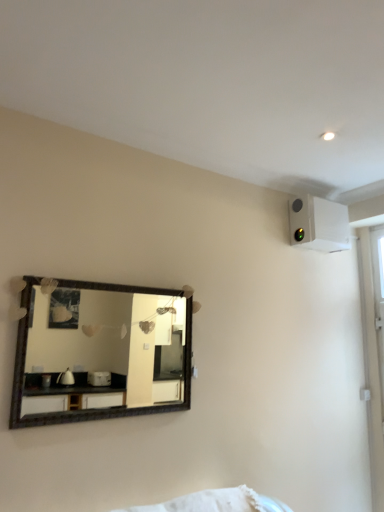
Question: Is wooden-framed mirror at upper left spatially inside white plastic air conditioning unit at upper right, or outside of it?

Choices:
 (A) inside
 (B) outside

Answer: (B)

Question: In the image, is wooden-framed mirror at upper left positioned in front of or behind white plastic air conditioning unit at upper right?

Choices:
 (A) behind
 (B) front

Answer: (B)

Question: In terms of width, does wooden-framed mirror at upper left look wider or thinner when compared to white plastic air conditioning unit at upper right?

Choices:
 (A) wide
 (B) thin

Answer: (B)

Question: Would you say white plastic air conditioning unit at upper right is to the left or to the right of wooden-framed mirror at upper left in the picture?

Choices:
 (A) right
 (B) left

Answer: (A)

Question: From their relative heights in the image, would you say white plastic air conditioning unit at upper right is taller or shorter than wooden-framed mirror at upper left?

Choices:
 (A) short
 (B) tall

Answer: (A)

Question: Choose the correct answer: Is white plastic air conditioning unit at upper right inside wooden-framed mirror at upper left or outside it?

Choices:
 (A) outside
 (B) inside

Answer: (A)

Question: From a real-world perspective, is white plastic air conditioning unit at upper right physically located above or below wooden-framed mirror at upper left?

Choices:
 (A) below
 (B) above

Answer: (B)